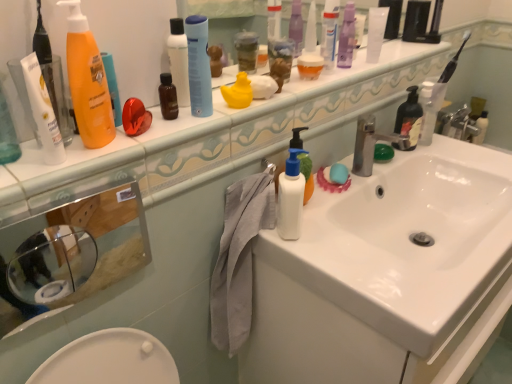
At what (x,y) coordinates should I click in order to perform the action: click on vacant space in front of white plastic toothbrush at upper right. Please return your answer as a coordinate pair (x, y). The image size is (512, 384). Looking at the image, I should click on (462, 152).